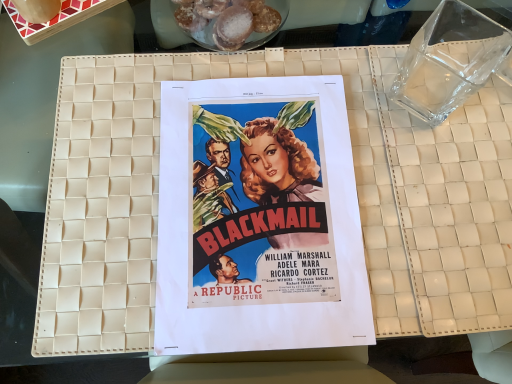
Find the location of `matte paper poster at center`. matte paper poster at center is located at coordinates (258, 218).

Describe the element at coordinates (258, 218) in the screenshot. I see `matte paper poster at center` at that location.

Find the location of a particular element. The image size is (512, 384). sugared doughnuts at upper center is located at coordinates (241, 26).

The height and width of the screenshot is (384, 512). What do you see at coordinates (241, 26) in the screenshot?
I see `sugared doughnuts at upper center` at bounding box center [241, 26].

The height and width of the screenshot is (384, 512). Identify the location of matte paper poster at center. (258, 218).

Can you confirm if matte paper poster at center is positioned to the left of sugared doughnuts at upper center?

No.

Which object is closer to the camera taking this photo, matte paper poster at center or sugared doughnuts at upper center?

matte paper poster at center.

Between point (184, 237) and point (230, 12), which one is positioned in front?

Positioned in front is point (184, 237).

From the image's perspective, is matte paper poster at center positioned above or below sugared doughnuts at upper center?

From the image's perspective, matte paper poster at center appears below sugared doughnuts at upper center.

From a real-world perspective, is matte paper poster at center above or below sugared doughnuts at upper center?

matte paper poster at center is situated lower than sugared doughnuts at upper center in the real world.

Which of these two, matte paper poster at center or sugared doughnuts at upper center, is wider?

With larger width is matte paper poster at center.

From their relative heights in the image, would you say matte paper poster at center is taller or shorter than sugared doughnuts at upper center?

matte paper poster at center is shorter than sugared doughnuts at upper center.

Considering the sizes of objects matte paper poster at center and sugared doughnuts at upper center in the image provided, who is smaller, matte paper poster at center or sugared doughnuts at upper center?

sugared doughnuts at upper center is smaller.

Is sugared doughnuts at upper center located within matte paper poster at center?

That's incorrect, sugared doughnuts at upper center is not inside matte paper poster at center.

Is matte paper poster at center far from sugared doughnuts at upper center?

No, matte paper poster at center is not far away from sugared doughnuts at upper center.

Is matte paper poster at center facing towards sugared doughnuts at upper center?

Yes, matte paper poster at center is facing sugared doughnuts at upper center.

Image resolution: width=512 pixels, height=384 pixels. Identify the location of food above the matte paper poster at center (from a real-world perspective). (241, 26).

Based on the photo, is sugared doughnuts at upper center to the left of matte paper poster at center from the viewer's perspective?

Yes, sugared doughnuts at upper center is to the left of matte paper poster at center.

Is the depth of sugared doughnuts at upper center greater than that of matte paper poster at center?

Yes, it is.

Which is less distant, (266,33) or (167,93)?

Point (167,93)

From the image's perspective, does sugared doughnuts at upper center appear higher than matte paper poster at center?

Yes, from the image's perspective, sugared doughnuts at upper center is above matte paper poster at center.

Looking at this image, from a real-world perspective, who is located higher, sugared doughnuts at upper center or matte paper poster at center?

sugared doughnuts at upper center is physically above.

In terms of width, does sugared doughnuts at upper center look wider or thinner when compared to matte paper poster at center?

sugared doughnuts at upper center is thinner than matte paper poster at center.

In terms of height, does sugared doughnuts at upper center look taller or shorter compared to matte paper poster at center?

sugared doughnuts at upper center is taller than matte paper poster at center.

Considering the sizes of objects sugared doughnuts at upper center and matte paper poster at center in the image provided, who is smaller, sugared doughnuts at upper center or matte paper poster at center?

Smaller between the two is sugared doughnuts at upper center.

Consider the image. Is matte paper poster at center located within sugared doughnuts at upper center?

Definitely not — matte paper poster at center is not inside sugared doughnuts at upper center.

Is sugared doughnuts at upper center next to matte paper poster at center and touching it?

No, sugared doughnuts at upper center is not making contact with matte paper poster at center.

Is sugared doughnuts at upper center positioned with its back to matte paper poster at center?

sugared doughnuts at upper center is not turned away from matte paper poster at center.

The image size is (512, 384). In the image, there is a matte paper poster at center. What are the coordinates of `food above it (from the image's perspective)` in the screenshot? It's located at (241, 26).

What are the coordinates of `poster lying in front of the sugared doughnuts at upper center` in the screenshot? It's located at (258, 218).

Locate an element on the screen. The image size is (512, 384). poster below the sugared doughnuts at upper center (from a real-world perspective) is located at coordinates (258, 218).